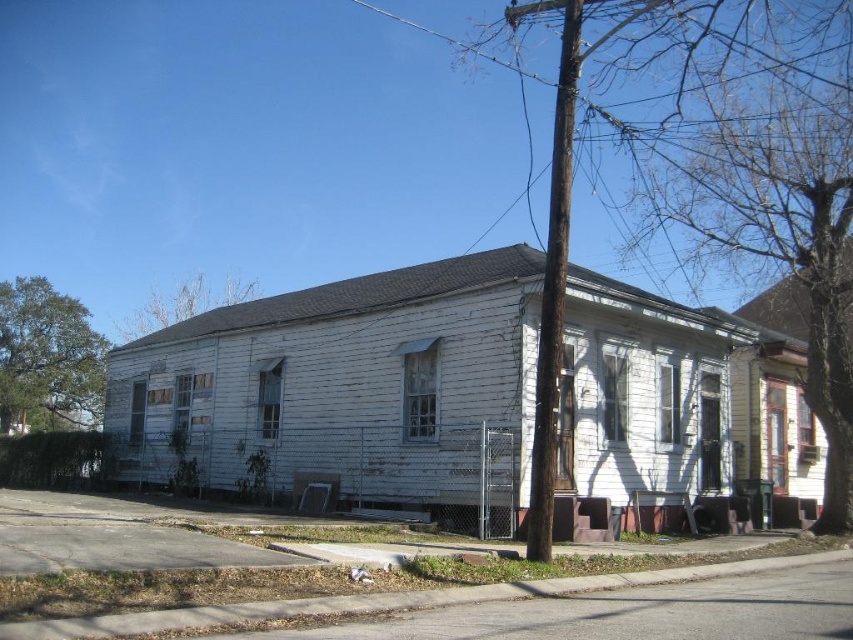
Question: Which point is farther to the camera?

Choices:
 (A) green leafy tree at left
 (B) bare wood tree at upper right
 (C) brown leafy tree at upper left

Answer: (A)

Question: Can you confirm if bare wood tree at upper right is smaller than brown leafy tree at upper left?

Choices:
 (A) no
 (B) yes

Answer: (A)

Question: Among these objects, which one is nearest to the camera?

Choices:
 (A) brown leafy tree at upper left
 (B) green leafy tree at left
 (C) bare wood tree at upper right

Answer: (C)

Question: Where is bare wood tree at upper right located in relation to green leafy tree at left in the image?

Choices:
 (A) above
 (B) below

Answer: (A)

Question: Observing the image, what is the correct spatial positioning of bare wood tree at upper right in reference to green leafy tree at left?

Choices:
 (A) right
 (B) left

Answer: (A)

Question: Which of these objects is positioned closest to the green leafy tree at left?

Choices:
 (A) brown leafy tree at upper left
 (B) bare wood tree at upper right

Answer: (A)